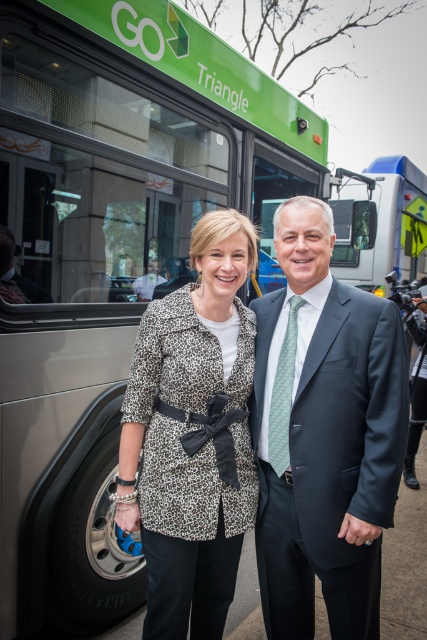
You are a fashion designer observing two people in the image. You need to determine the spatial relationship between the dark gray suit at center and the leopard print coat at center. Which one is positioned higher?

The dark gray suit at center is above leopard print coat at center, so the dark gray suit at center is positioned higher.

You are a photographer at the scene and want to capture both the dark gray suit at center and the leopard print coat at center in a single frame. Which object should you focus on first to ensure both are in the frame?

The dark gray suit at center is taller than the leopard print coat at center, so you should focus on the dark gray suit at center first to ensure both are in the frame.

You are a fashion designer observing two people at a bus stop. You notice the dark gray suit at center and the leopard print coat at center. Which clothing item is closer to the bus?

The dark gray suit at center is 11.05 inches from leopard print coat at center, so the dark gray suit at center is closer to the bus than the leopard print coat at center.